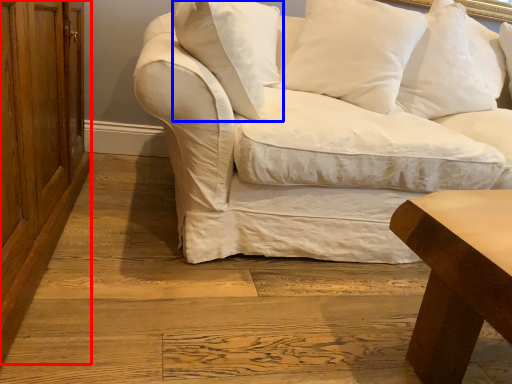
Question: Which object appears farthest to the camera in this image, dresser (highlighted by a red box) or pillow (highlighted by a blue box)?

Choices:
 (A) dresser
 (B) pillow

Answer: (B)